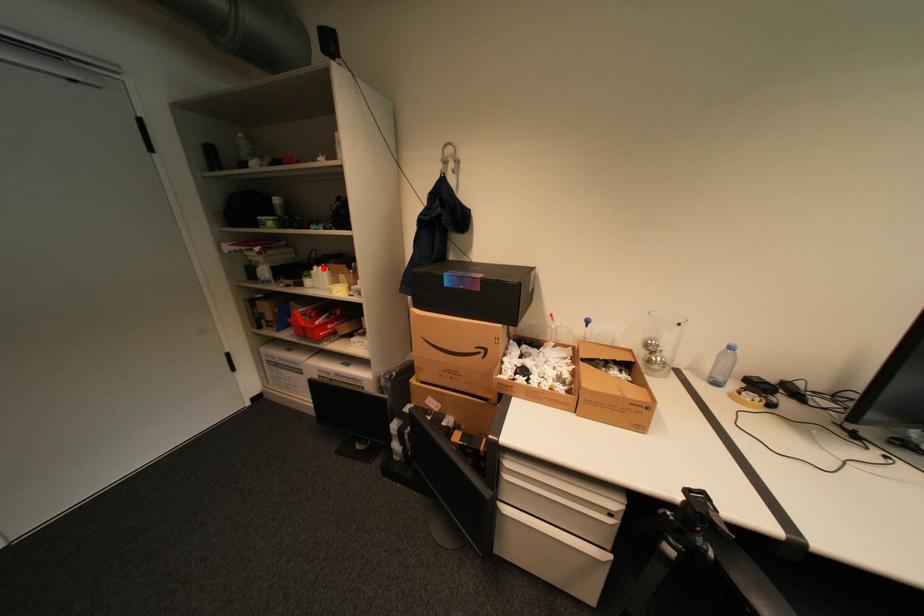
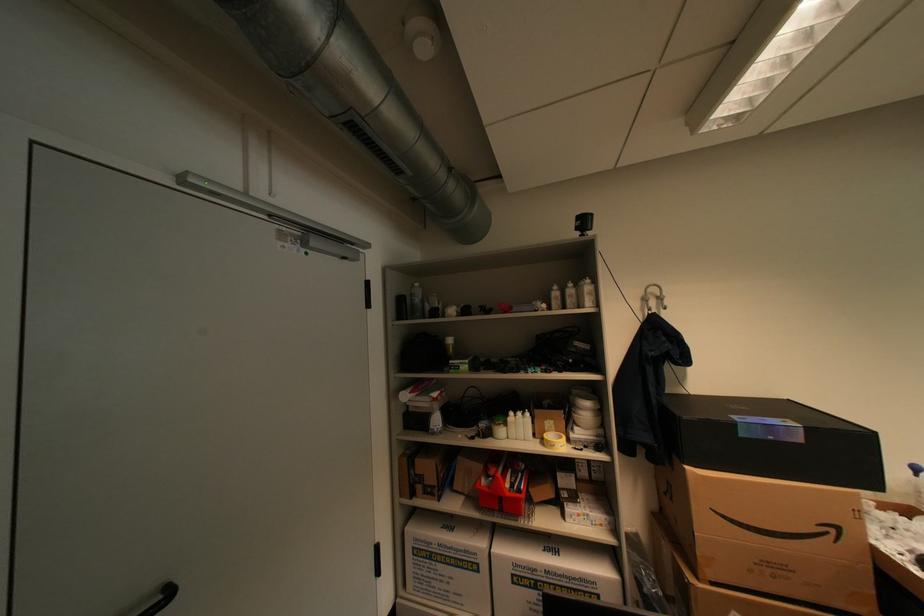
The point at the highlighted location is marked in the first image. Where is the corresponding point in the second image?

(519, 414)